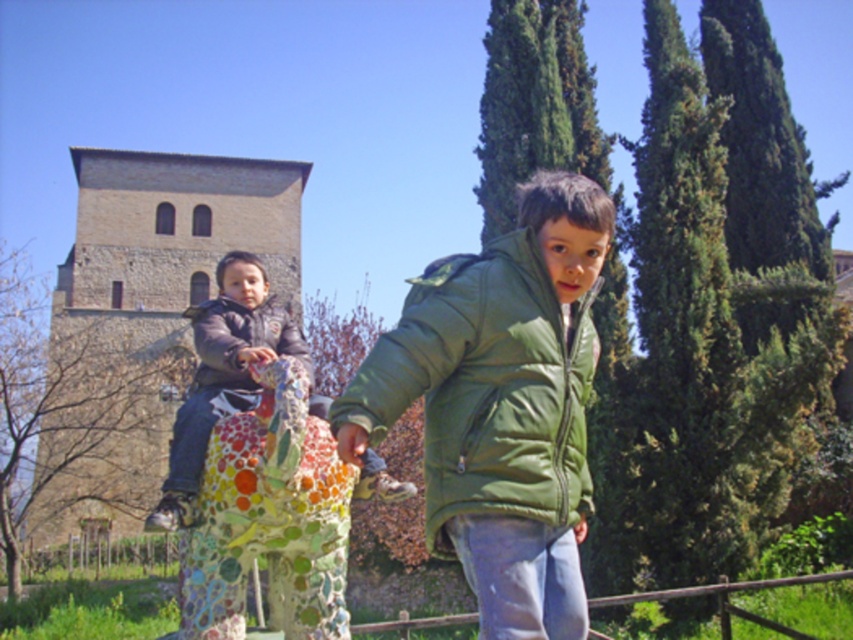
Between green quilted jacket at center and matte black jacket at left, which one has more height?

matte black jacket at left

Is green quilted jacket at center smaller than matte black jacket at left?

Yes, green quilted jacket at center is smaller than matte black jacket at left.

Locate an element on the screen. green quilted jacket at center is located at coordinates (488, 381).

Does matte black jacket at left have a larger size compared to dark gray matte jacket at center?

Correct, matte black jacket at left is larger in size than dark gray matte jacket at center.

Describe the element at coordinates (222, 376) in the screenshot. This screenshot has height=640, width=853. I see `matte black jacket at left` at that location.

Locate an element on the screen. This screenshot has width=853, height=640. matte black jacket at left is located at coordinates (222, 376).

Find the location of a particular element. matte black jacket at left is located at coordinates (222, 376).

Who is more forward, (431,515) or (231,337)?

Point (431,515) is more forward.

Image resolution: width=853 pixels, height=640 pixels. What do you see at coordinates (488, 381) in the screenshot?
I see `green quilted jacket at center` at bounding box center [488, 381].

Is point (590, 504) positioned after point (210, 349)?

No.

This screenshot has width=853, height=640. I want to click on green quilted jacket at center, so click(x=488, y=381).